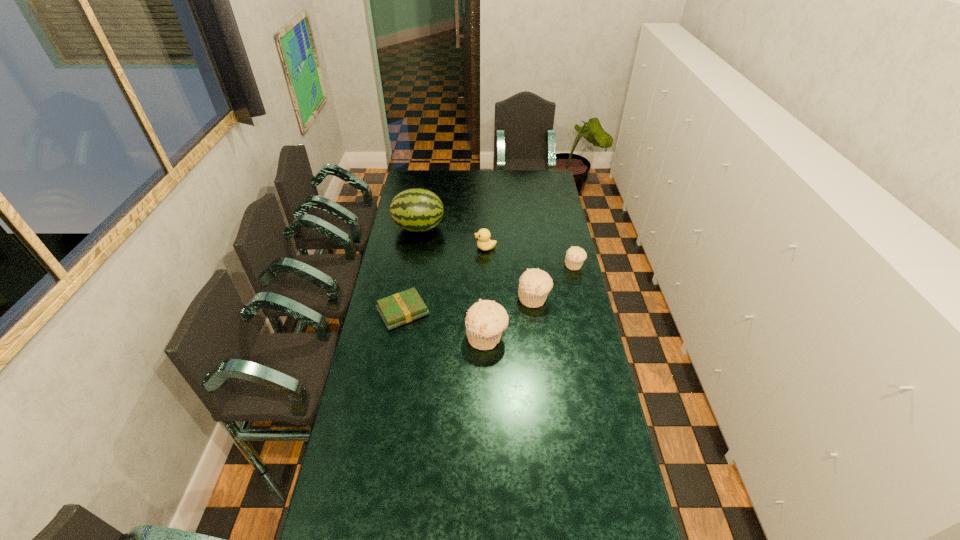
In order to click on vacant area situated on the back of the second nearest muffin in this screenshot , I will do `click(526, 235)`.

The image size is (960, 540). In order to click on free point located on the back of the shortest muffin in this screenshot , I will do `click(564, 218)`.

Locate an element on the screen. This screenshot has height=540, width=960. vacant space situated on the face of the fifth nearest object is located at coordinates (447, 248).

The height and width of the screenshot is (540, 960). In order to click on vacant space positioned 0.230m on the face of the fifth nearest object in this screenshot , I will do `click(429, 248)`.

Image resolution: width=960 pixels, height=540 pixels. What are the coordinates of `vacant space located on the face of the fifth nearest object` in the screenshot? It's located at (407, 248).

The image size is (960, 540). Find the location of `free space located at the stem end of the watermelon`. free space located at the stem end of the watermelon is located at coordinates (456, 228).

Find the location of a particular element. Image resolution: width=960 pixels, height=540 pixels. vacant space situated 0.060m on the front of the shortest object is located at coordinates (397, 343).

At what (x,y) coordinates should I click in order to perform the action: click on watermelon located at the left edge. Please return your answer as a coordinate pair (x, y). The height and width of the screenshot is (540, 960). Looking at the image, I should click on (416, 210).

In order to click on book that is at the left edge in this screenshot , I will do `click(401, 308)`.

Locate an element on the screen. The image size is (960, 540). vacant area at the far edge of the desktop is located at coordinates (432, 189).